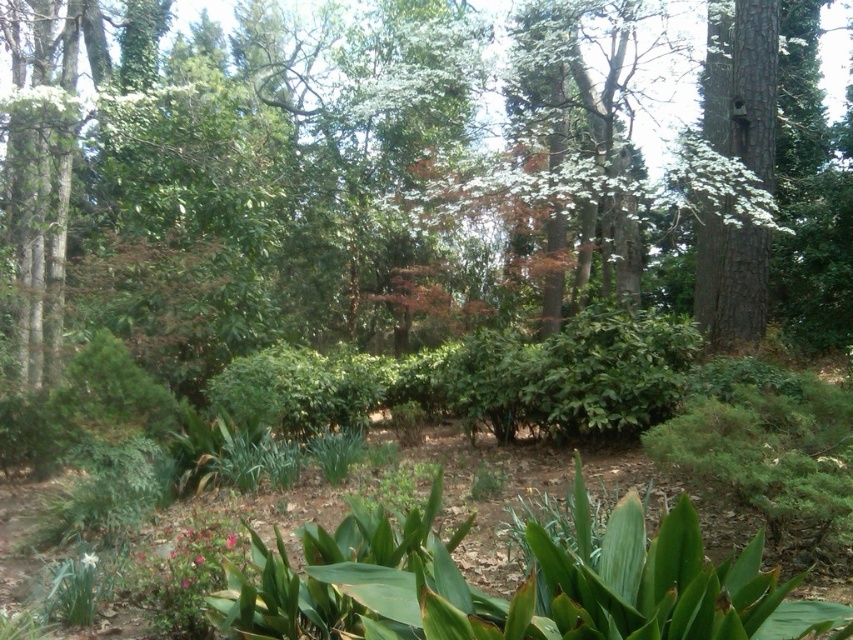
From the picture: You are a gardener planning to plant a new flower bed. You have a pink matte flower at lower center and a brown rough bark tree at upper right. Considering their sizes, which one would require more space in the garden?

The brown rough bark tree at upper right requires more space in the garden because it has a larger size compared to the pink matte flower at lower center.

You are a gardener planning to prune the brown rough bark tree at upper right and the pink matte flower at lower left. Which object should you start with to work from the closest to furthest distance first?

You should start with the brown rough bark tree at upper right first because it is closer to you than the pink matte flower at lower left.

You are a gardener who needs to install a new sprinkler system in the garden. The brown rough bark tree at upper right and the green matte flower at lower left are critical to protect. What is the minimum distance you should keep between the sprinkler and these two plants to ensure they are both adequately watered without overwatering?

The minimum distance between the sprinkler and both the brown rough bark tree at upper right and the green matte flower at lower left should be at least 3.17 meters, as they are 6.34 meters apart. This ensures the sprinkler can cover both plants effectively without overwatering either.